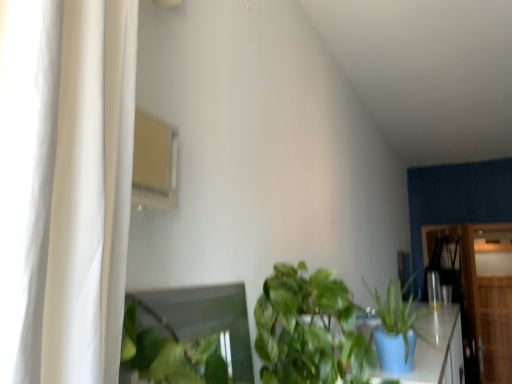
Question: Is the position of wooden dresser at right, placed as the second dresser when sorted from front to back, more distant than that of wooden dresser at right, the second dresser from the back?

Choices:
 (A) no
 (B) yes

Answer: (B)

Question: From the image's perspective, is wooden dresser at right, placed as the second dresser when sorted from front to back, beneath wooden dresser at right, which is counted as the 1th dresser, starting from the left?

Choices:
 (A) yes
 (B) no

Answer: (A)

Question: Is wooden dresser at right, which is the first dresser from right to left, shorter than wooden dresser at right, the second dresser from the back?

Choices:
 (A) yes
 (B) no

Answer: (B)

Question: Is there a large distance between wooden dresser at right, placed as the second dresser when sorted from front to back, and wooden dresser at right, which ranks as the second dresser in right-to-left order?

Choices:
 (A) yes
 (B) no

Answer: (B)

Question: Is wooden dresser at right, which is the first dresser from right to left, facing away from wooden dresser at right, the 1th dresser from the front?

Choices:
 (A) no
 (B) yes

Answer: (A)

Question: From a real-world perspective, is wooden dresser at right, the second dresser from the back, above or below green leafy plant at center, placed as the second houseplant when sorted from right to left?

Choices:
 (A) below
 (B) above

Answer: (A)

Question: In the image, is wooden dresser at right, which is counted as the 1th dresser, starting from the left, positioned in front of or behind green leafy plant at center, marked as the first houseplant in a left-to-right arrangement?

Choices:
 (A) behind
 (B) front

Answer: (A)

Question: Looking at their shapes, would you say wooden dresser at right, the 1th dresser from the front, is wider or thinner than green leafy plant at center, placed as the second houseplant when sorted from right to left?

Choices:
 (A) thin
 (B) wide

Answer: (A)

Question: Is point coord(510,322) closer or farther from the camera than point coord(309,336)?

Choices:
 (A) farther
 (B) closer

Answer: (A)

Question: Considering their positions, is green leafy plant at center, placed as the second houseplant when sorted from right to left, located in front of or behind matte blue pot at lower right, the 1th houseplant from the right?

Choices:
 (A) behind
 (B) front

Answer: (B)

Question: From the image's perspective, is green leafy plant at center, marked as the first houseplant in a left-to-right arrangement, positioned above or below matte blue pot at lower right, the 1th houseplant from the right?

Choices:
 (A) below
 (B) above

Answer: (B)

Question: In terms of width, does green leafy plant at center, marked as the first houseplant in a left-to-right arrangement, look wider or thinner when compared to matte blue pot at lower right, the 1th houseplant from the right?

Choices:
 (A) thin
 (B) wide

Answer: (B)

Question: Is point (273, 374) positioned closer to the camera than point (389, 337)?

Choices:
 (A) farther
 (B) closer

Answer: (B)

Question: Is matte blue pot at lower right, the 1th houseplant from the right, wider or thinner than wooden dresser at right, which is counted as the 1th dresser, starting from the left?

Choices:
 (A) thin
 (B) wide

Answer: (A)

Question: Is matte blue pot at lower right, the 1th houseplant from the right, inside the boundaries of wooden dresser at right, the second dresser from the back, or outside?

Choices:
 (A) inside
 (B) outside

Answer: (B)